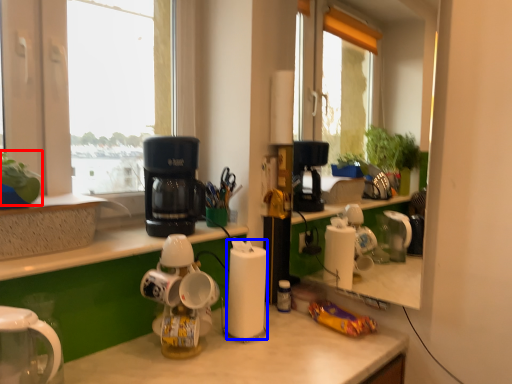
Question: Which point is closer to the camera, plant (highlighted by a red box) or paper towel (highlighted by a blue box)?

Choices:
 (A) plant
 (B) paper towel

Answer: (A)